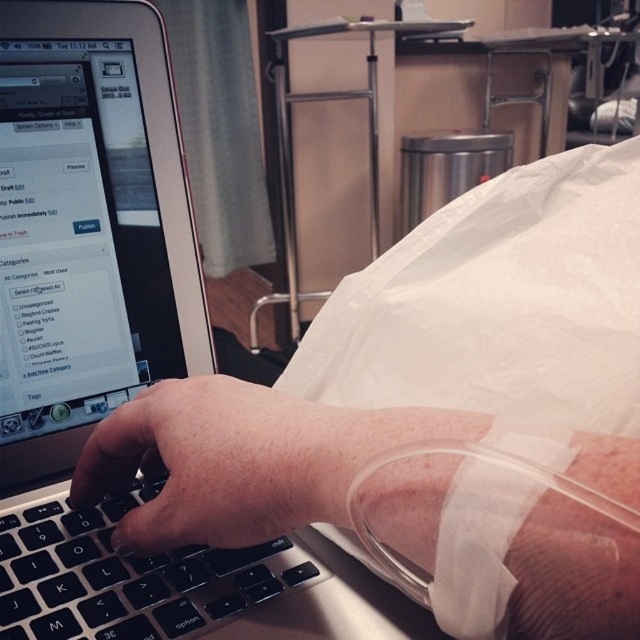
Question: Which object appears closest to the camera in this image?

Choices:
 (A) satin black laptop at center
 (B) black matte keyboard at center

Answer: (B)

Question: Does skinny white hand at center appear under smooth skin hand at center?

Choices:
 (A) no
 (B) yes

Answer: (B)

Question: Considering the real-world distances, which object is closest to the sleek silver laptop at center?

Choices:
 (A) satin black laptop at center
 (B) black matte keyboard at center

Answer: (A)

Question: Which point appears closest to the camera in this image?

Choices:
 (A) (243, 435)
 (B) (72, 456)
 (C) (328, 573)
 (D) (60, 339)

Answer: (A)

Question: Can you confirm if sleek silver laptop at center is smaller than black matte keyboard at center?

Choices:
 (A) no
 (B) yes

Answer: (A)

Question: Is smooth skin hand at center bigger than black matte keyboard at center?

Choices:
 (A) yes
 (B) no

Answer: (A)